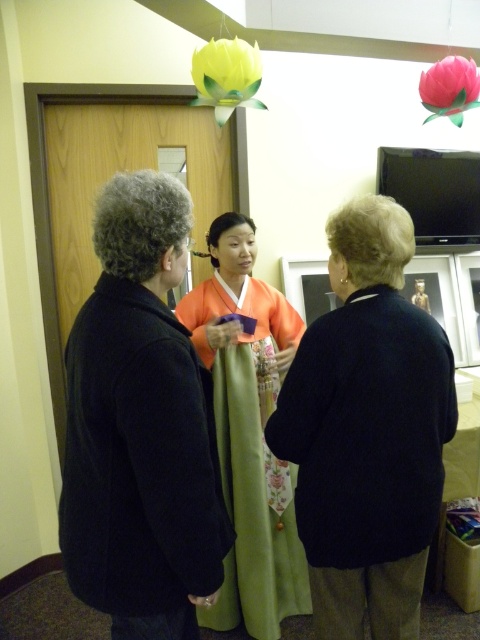
You are standing in the room and need to place a small table exactly between the green satin robe at center and the nearest wall. Which direction should you move from the robe to reach the wall?

The green satin robe at center is located at point (301,400). To place the table between the robe and the nearest wall, you should move towards the wall that is closest to the robe. However, without knowing the room dimensions or the wall locations, it is impossible to determine the exact direction. Please provide more information about the room layout.

You are a photographer setting up for a cultural event. You need to position a light source so that it illuminates both the orange satin kimono at center and the yellow paper flower at upper center. Based on their positions, where should you place the light source relative to these objects?

The orange satin kimono at center is located below the yellow paper flower at upper center. To illuminate both effectively, the light source should be placed above the yellow paper flower at upper center so that light can reach downward onto the orange satin kimono at center and still illuminate the flower itself.

You are taking a photo of the cultural event scene. You want to focus on the two points marked as point (67, 568) and point (249, 604). Which point should you focus on first to ensure the closest subject is in sharp focus?

Point (67, 568) is closer to the camera than point (249, 604), so you should focus on point (67, 568) first to ensure the closest subject is in sharp focus.